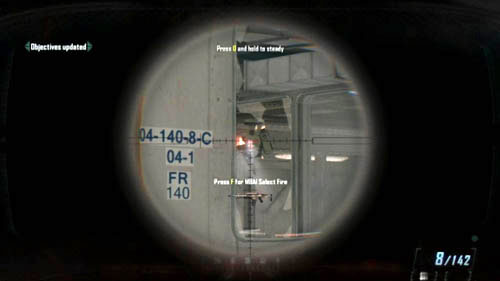
This screenshot has height=281, width=500. What are the coordinates of `light` in the screenshot? It's located at (333, 162).